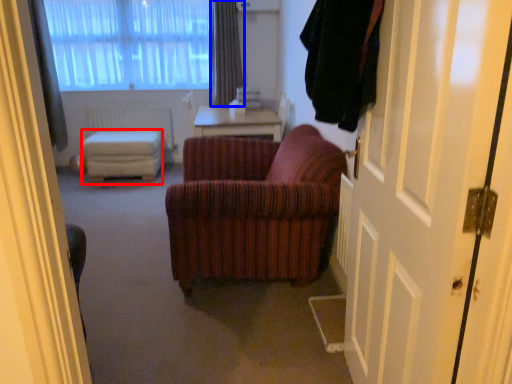
Question: Which object appears farthest to the camera in this image, stool (highlighted by a red box) or curtain (highlighted by a blue box)?

Choices:
 (A) stool
 (B) curtain

Answer: (B)